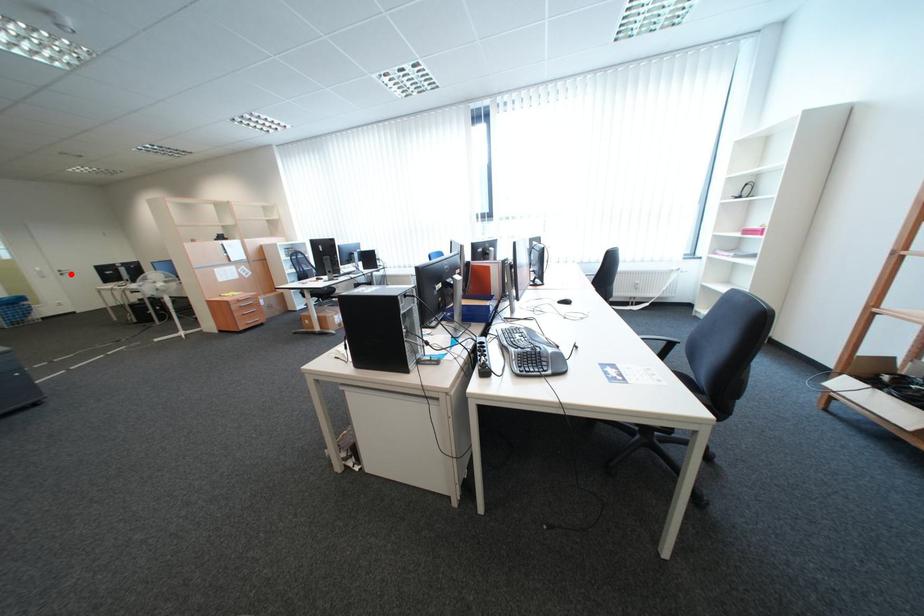
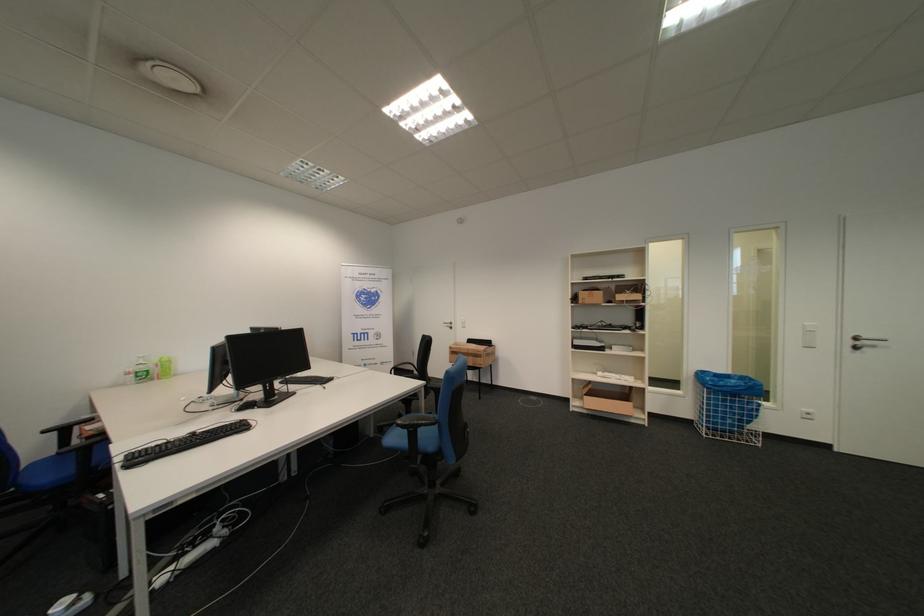
Question: A red point is marked in image1. In image2, is the corresponding 3D point closer to the camera or farther? Reply with the corresponding letter.

Choices:
 (A) The corresponding 3D point is closer.
 (B) The corresponding 3D point is farther.

Answer: (A)